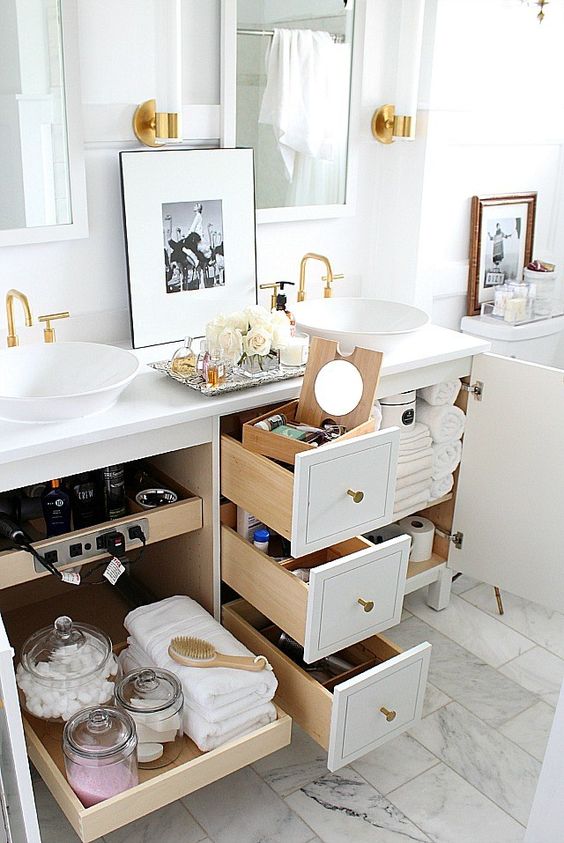
Where is `toilet paper`? toilet paper is located at coordinates (428, 528).